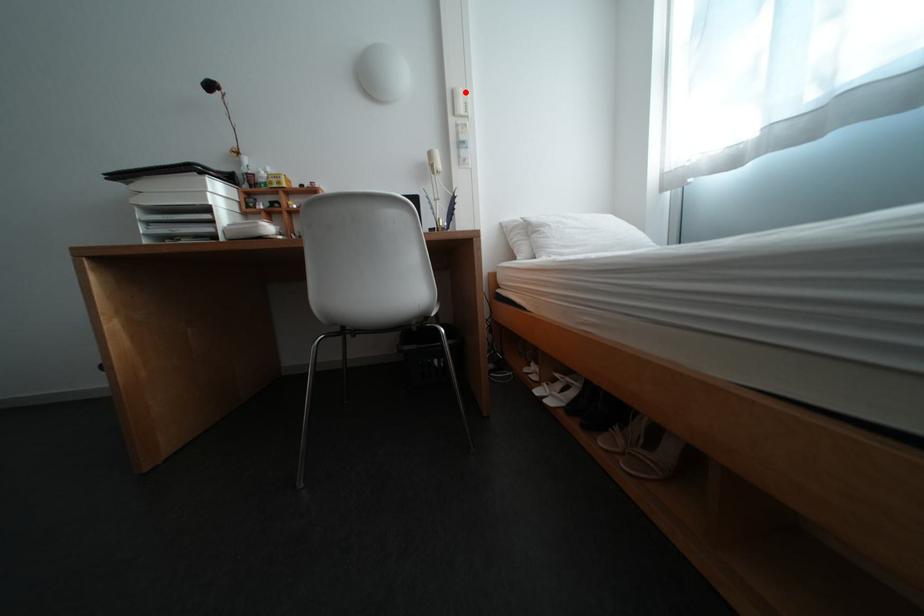
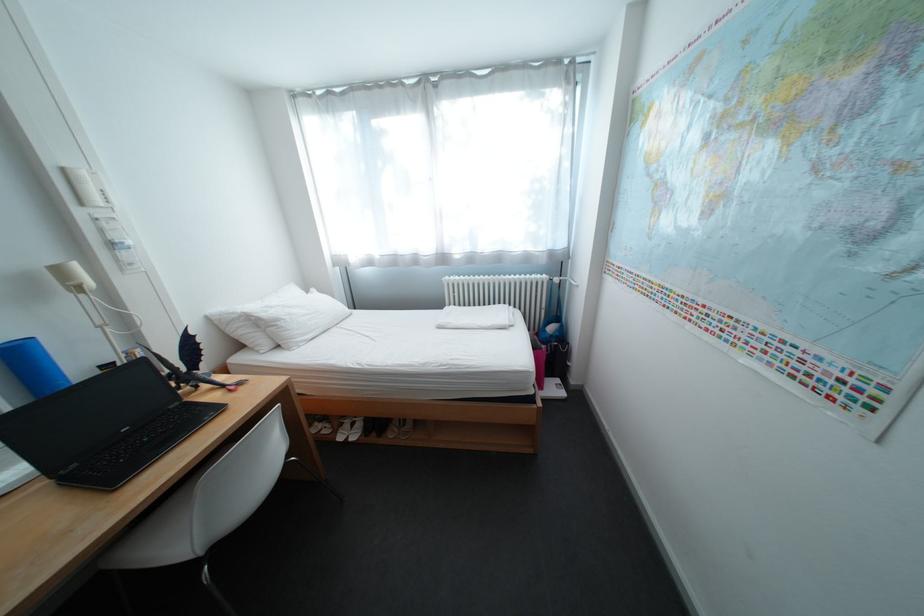
Where in the second image is the point corresponding to the highlighted location from the first image?

(76, 171)